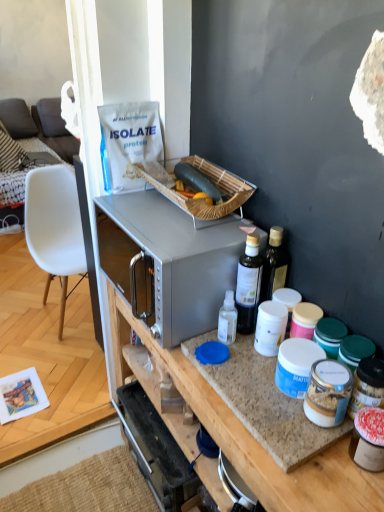
Question: Based on their sizes in the image, would you say white plastic chair at left is bigger or smaller than bamboo picnic basket at upper center?

Choices:
 (A) small
 (B) big

Answer: (B)

Question: From the image's perspective, is white plastic chair at left located above or below bamboo picnic basket at upper center?

Choices:
 (A) below
 (B) above

Answer: (B)

Question: Which of these objects is positioned farthest from the white plastic chair at left?

Choices:
 (A) white plastic chair at left
 (B) bamboo picnic basket at upper center
 (C) green matte zucchini at center
 (D) transparent plastic bottle at center, arranged as the 2th bottle when viewed from the right
 (E) satin silver microwave at center

Answer: (A)

Question: Based on their relative distances, which object is nearer to the white plastic chair at left?

Choices:
 (A) bamboo picnic basket at upper center
 (B) translucent plastic bottle at center-right, which is counted as the 1th bottle, starting from the right
 (C) satin silver microwave at center
 (D) granite countertop at center
 (E) green matte zucchini at center

Answer: (A)